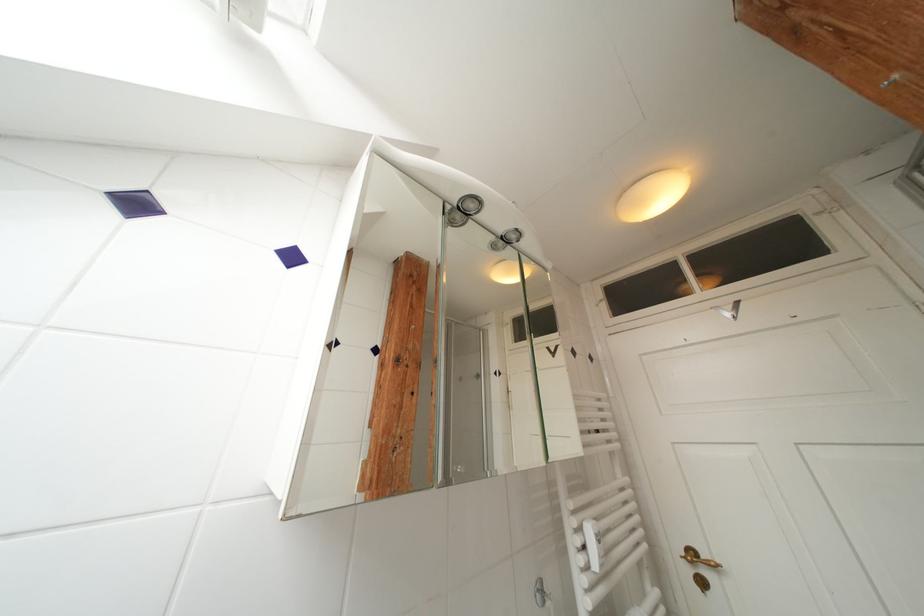
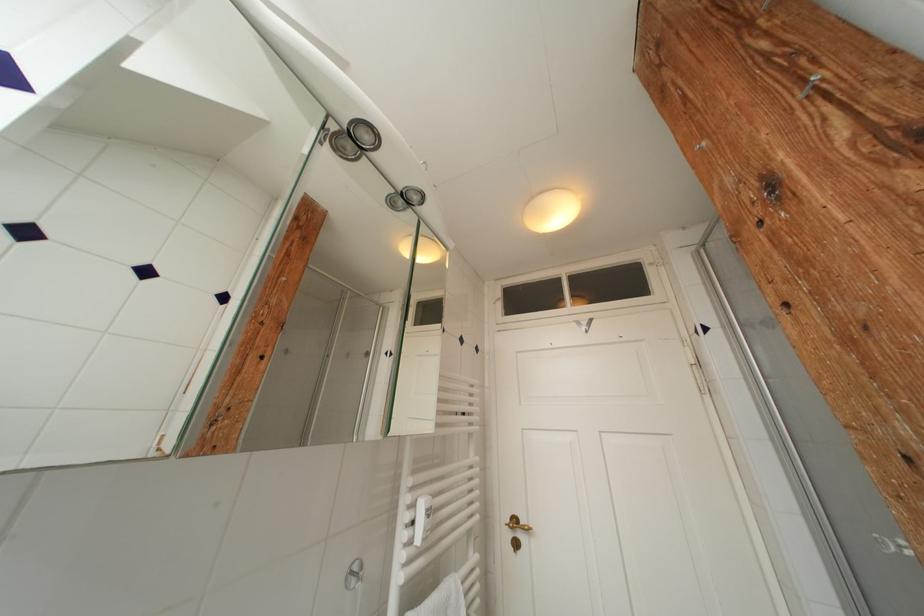
Question: The camera is either moving clockwise (left) or counter-clockwise (right) around the object. The first image is from the beginning of the video and the second image is from the end. Is the camera moving left or right when shooting the video?

Choices:
 (A) Left
 (B) Right

Answer: (A)